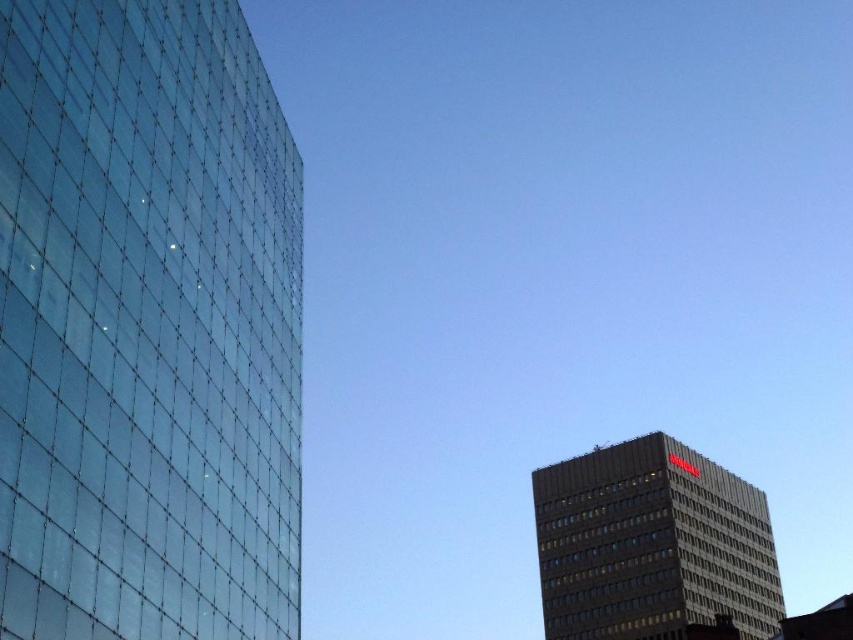
This screenshot has height=640, width=853. I want to click on transparent glass building at left, so click(x=146, y=324).

Is transparent glass building at left wider than dark gray concrete building at lower right?

Incorrect, transparent glass building at left's width does not surpass dark gray concrete building at lower right's.

Who is more distant from viewer, (x=276, y=291) or (x=628, y=529)?

Positioned behind is point (x=628, y=529).

Locate an element on the screen. This screenshot has height=640, width=853. transparent glass building at left is located at coordinates (146, 324).